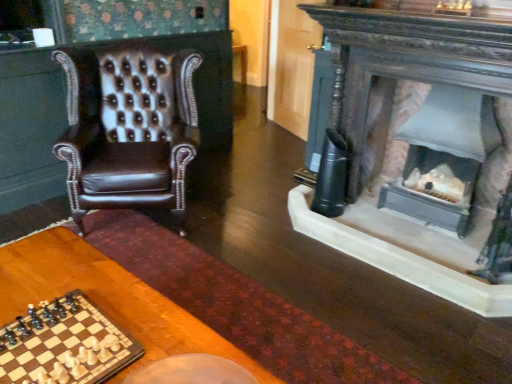
You are a GUI agent. You are given a task and a screenshot of the screen. Output one action in this format:
    pyautogui.click(x=<x>, y=<y>)
    Task: Click on the free point above wooden table at lower left (from a real-world perspective)
    This screenshot has height=384, width=512.
    Given the screenshot: What is the action you would take?
    pyautogui.click(x=90, y=292)